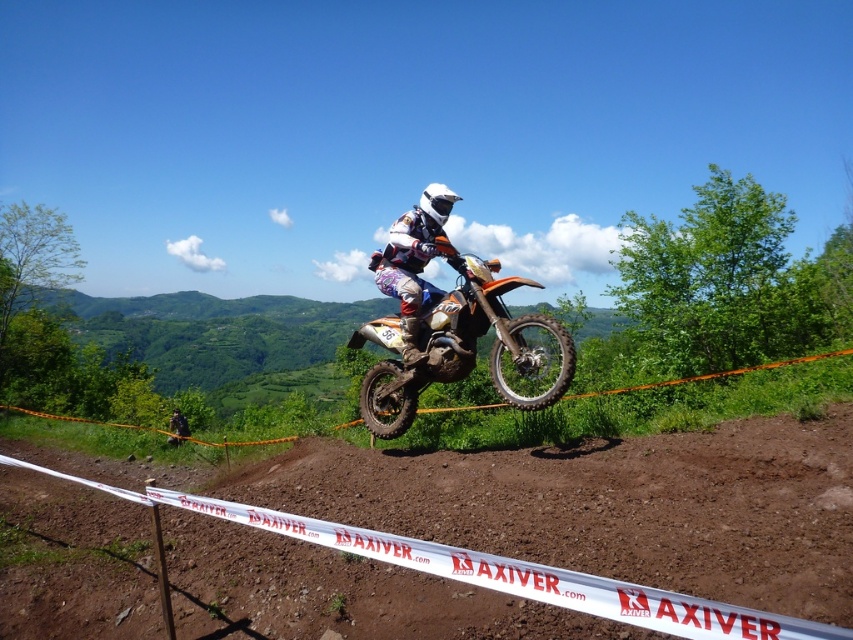
You are a drone operator trying to capture the rider midair. The brown dirt field at center and the white matte helmet at center are both in your camera view. Which object is narrower in width?

The brown dirt field at center is narrower in width than the white matte helmet at center.

You are a photographer trying to capture the rider and their motorcycle in a single shot. Given the orange matte dirt bike at center and the white matte helmet at center, which object would you need to focus on first to ensure both are in frame?

The orange matte dirt bike at center is larger in size compared to the white matte helmet at center, so you should focus on the dirt bike first to ensure both are in frame.